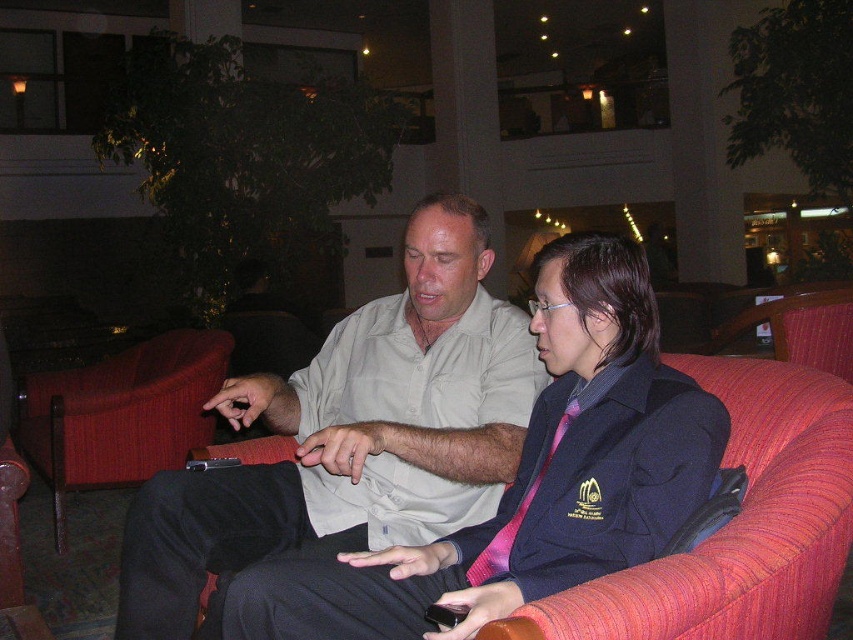
Question: Which point is farther to the camera?

Choices:
 (A) (120, 376)
 (B) (837, 449)

Answer: (A)

Question: Is light beige shirt at center to the right of pink satin tie at center from the viewer's perspective?

Choices:
 (A) yes
 (B) no

Answer: (B)

Question: Can you confirm if light beige shirt at center is positioned below red fabric couch at right?

Choices:
 (A) no
 (B) yes

Answer: (A)

Question: From the image, what is the correct spatial relationship of light beige shirt at center in relation to pink satin tie at center?

Choices:
 (A) below
 (B) above

Answer: (B)

Question: Which object is the farthest from the red fabric armchair at left?

Choices:
 (A) red fabric couch at right
 (B) pink satin tie at center
 (C) light beige shirt at center

Answer: (A)

Question: Which object is the farthest from the light beige shirt at center?

Choices:
 (A) pink satin tie at center
 (B) red fabric couch at right
 (C) red fabric armchair at left

Answer: (C)